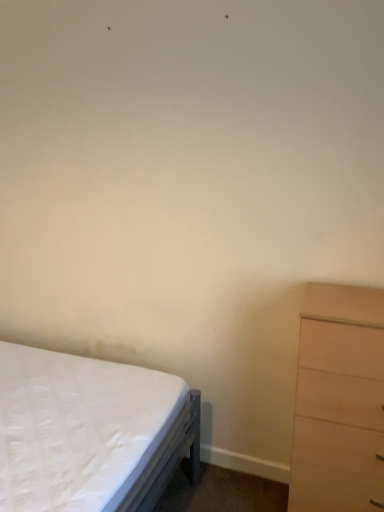
The width and height of the screenshot is (384, 512). Find the location of `light brown wood chest of drawers at right`. light brown wood chest of drawers at right is located at coordinates (338, 400).

What do you see at coordinates (338, 400) in the screenshot? The height and width of the screenshot is (512, 384). I see `light brown wood chest of drawers at right` at bounding box center [338, 400].

Identify the location of white quilted mattress at lower left. This screenshot has width=384, height=512. (90, 432).

The height and width of the screenshot is (512, 384). What do you see at coordinates (90, 432) in the screenshot? I see `white quilted mattress at lower left` at bounding box center [90, 432].

In order to click on light brown wood chest of drawers at right in this screenshot , I will do `click(338, 400)`.

Considering the positions of objects light brown wood chest of drawers at right and white quilted mattress at lower left in the image provided, who is more to the left, light brown wood chest of drawers at right or white quilted mattress at lower left?

white quilted mattress at lower left is more to the left.

Does light brown wood chest of drawers at right come behind white quilted mattress at lower left?

Yes, it is behind white quilted mattress at lower left.

Considering the points (312, 370) and (3, 373), which point is in front, point (312, 370) or point (3, 373)?

The point (312, 370) is in front.

From the image's perspective, is light brown wood chest of drawers at right above white quilted mattress at lower left?

Yes, from the image's perspective, light brown wood chest of drawers at right is over white quilted mattress at lower left.

From a real-world perspective, between light brown wood chest of drawers at right and white quilted mattress at lower left, who is vertically higher?

light brown wood chest of drawers at right, from a real-world perspective.

Considering the sizes of light brown wood chest of drawers at right and white quilted mattress at lower left in the image, is light brown wood chest of drawers at right wider or thinner than white quilted mattress at lower left?

light brown wood chest of drawers at right is thinner than white quilted mattress at lower left.

Considering the relative sizes of light brown wood chest of drawers at right and white quilted mattress at lower left in the image provided, is light brown wood chest of drawers at right taller than white quilted mattress at lower left?

Correct, light brown wood chest of drawers at right is much taller as white quilted mattress at lower left.

Who is smaller, light brown wood chest of drawers at right or white quilted mattress at lower left?

With smaller size is light brown wood chest of drawers at right.

Is white quilted mattress at lower left completely or partially inside light brown wood chest of drawers at right?

No, white quilted mattress at lower left is not a part of light brown wood chest of drawers at right.

Is light brown wood chest of drawers at right beside white quilted mattress at lower left?

There is a gap between light brown wood chest of drawers at right and white quilted mattress at lower left.

Could you tell me if light brown wood chest of drawers at right is facing white quilted mattress at lower left?

No, light brown wood chest of drawers at right is not facing towards white quilted mattress at lower left.

Could you measure the distance between light brown wood chest of drawers at right and white quilted mattress at lower left?

light brown wood chest of drawers at right and white quilted mattress at lower left are 30.83 inches apart from each other.

Image resolution: width=384 pixels, height=512 pixels. Find the location of `the chest of drawers behind the white quilted mattress at lower left`. the chest of drawers behind the white quilted mattress at lower left is located at coordinates (338, 400).

Which object is positioned more to the right, white quilted mattress at lower left or light brown wood chest of drawers at right?

From the viewer's perspective, light brown wood chest of drawers at right appears more on the right side.

Is white quilted mattress at lower left in front of or behind light brown wood chest of drawers at right in the image?

Clearly, white quilted mattress at lower left is in front of light brown wood chest of drawers at right.

Which is further, (182, 389) or (303, 334)?

The point (182, 389) is farther.

From the image's perspective, is white quilted mattress at lower left positioned above or below light brown wood chest of drawers at right?

Based on their image positions, white quilted mattress at lower left is located beneath light brown wood chest of drawers at right.

From a real-world perspective, is white quilted mattress at lower left on top of light brown wood chest of drawers at right?

No, from a real-world perspective, white quilted mattress at lower left is not on top of light brown wood chest of drawers at right.

In terms of width, does white quilted mattress at lower left look wider or thinner when compared to light brown wood chest of drawers at right?

Considering their sizes, white quilted mattress at lower left looks broader than light brown wood chest of drawers at right.

Based on the photo, who is taller, white quilted mattress at lower left or light brown wood chest of drawers at right?

Standing taller between the two is light brown wood chest of drawers at right.

Which of these two, white quilted mattress at lower left or light brown wood chest of drawers at right, is bigger?

white quilted mattress at lower left.

Is white quilted mattress at lower left positioned beyond the bounds of light brown wood chest of drawers at right?

Yes, white quilted mattress at lower left is outside of light brown wood chest of drawers at right.

Are white quilted mattress at lower left and light brown wood chest of drawers at right beside each other?

There is a gap between white quilted mattress at lower left and light brown wood chest of drawers at right.

Is white quilted mattress at lower left aimed at light brown wood chest of drawers at right?

Yes, white quilted mattress at lower left is facing light brown wood chest of drawers at right.

How many degrees apart are the facing directions of white quilted mattress at lower left and light brown wood chest of drawers at right?

90.5 degrees separate the facing orientations of white quilted mattress at lower left and light brown wood chest of drawers at right.

Image resolution: width=384 pixels, height=512 pixels. What are the coordinates of `the chest of drawers located above the white quilted mattress at lower left (from a real-world perspective)` in the screenshot? It's located at (338, 400).

The width and height of the screenshot is (384, 512). I want to click on the chest of drawers that appears behind the white quilted mattress at lower left, so click(x=338, y=400).

Locate an element on the screen. The image size is (384, 512). chest of drawers above the white quilted mattress at lower left (from a real-world perspective) is located at coordinates (338, 400).